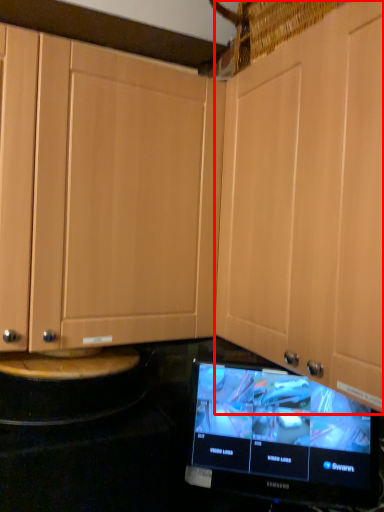
Question: Considering the relative positions of cabinetry (annotated by the red box) and television in the image provided, where is cabinetry (annotated by the red box) located with respect to the staircase?

Choices:
 (A) left
 (B) right

Answer: (B)